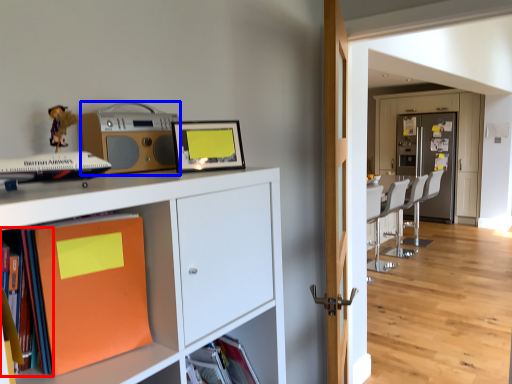
Question: Which object is further to the camera taking this photo, book (highlighted by a red box) or stereo (highlighted by a blue box)?

Choices:
 (A) book
 (B) stereo

Answer: (B)